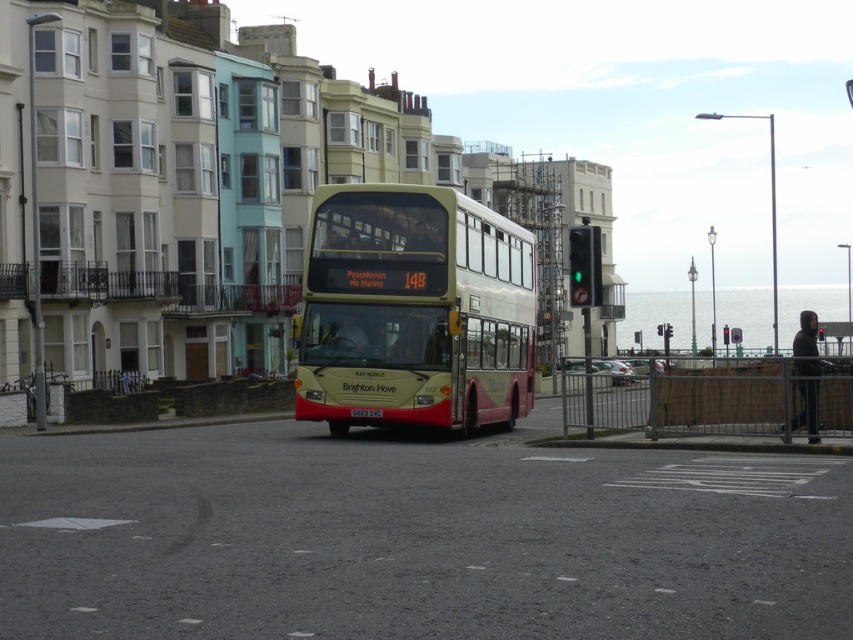
Does beige glossy decker bus at center have a greater width compared to green glass traffic light at center?

No.

Is beige glossy decker bus at center to the right of green glass traffic light at center from the viewer's perspective?

No, beige glossy decker bus at center is not to the right of green glass traffic light at center.

Where is `beige glossy decker bus at center`? beige glossy decker bus at center is located at coordinates (415, 310).